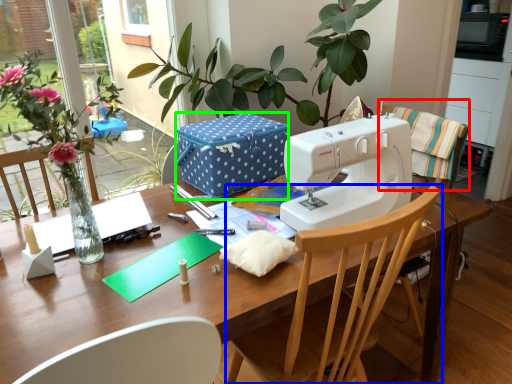
Question: Based on their relative distances, which object is nearer to chair (highlighted by a red box)? Choose from chair (highlighted by a blue box) and cardboard box (highlighted by a green box).

Choices:
 (A) chair
 (B) cardboard box

Answer: (B)